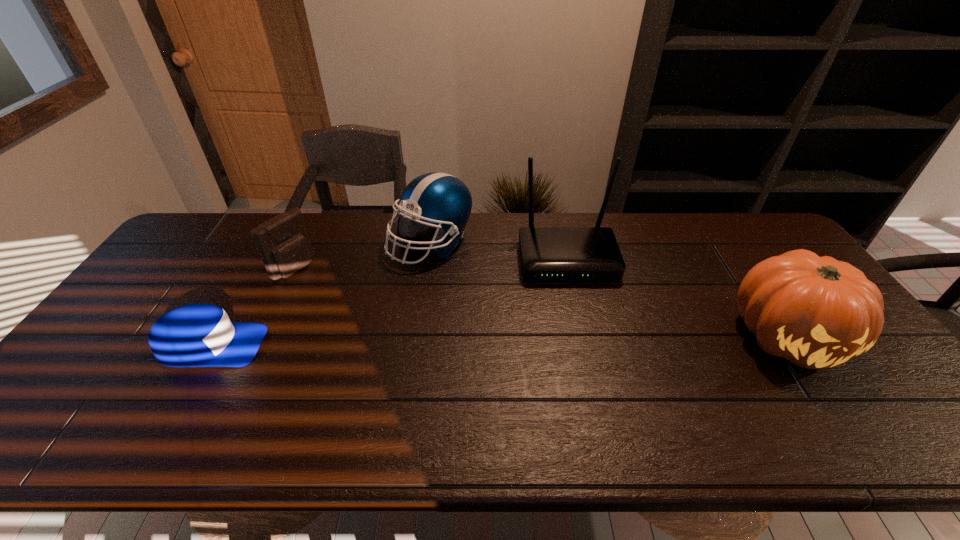
You are a GUI agent. You are given a task and a screenshot of the screen. Output one action in this format:
    pyautogui.click(x=<x>, y=<y>)
    Task: Click on the free spot on the desktop that is between the shortest object and the rightmost object and is positioned on the front-facing side of the router
    
    Given the screenshot: What is the action you would take?
    pyautogui.click(x=586, y=340)

This screenshot has width=960, height=540. Identify the location of free spot on the desktop that is between the shortest object and the pumpkin and is positioned at the front of the third object from left to right with the faceguard. (420, 342).

This screenshot has width=960, height=540. Find the location of `free spot on the desktop that is between the baseball cap and the pumpkin and is positioned with an open flap on the fourth tallest object`. free spot on the desktop that is between the baseball cap and the pumpkin and is positioned with an open flap on the fourth tallest object is located at coordinates (418, 342).